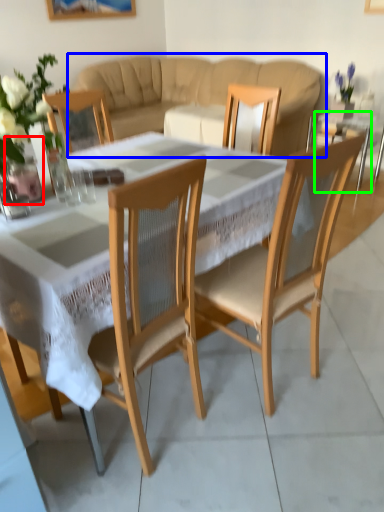
Question: Considering the real-world distances, which object is closest to glass vase (highlighted by a red box)? studio couch (highlighted by a blue box) or side table (highlighted by a green box).

Choices:
 (A) studio couch
 (B) side table

Answer: (B)